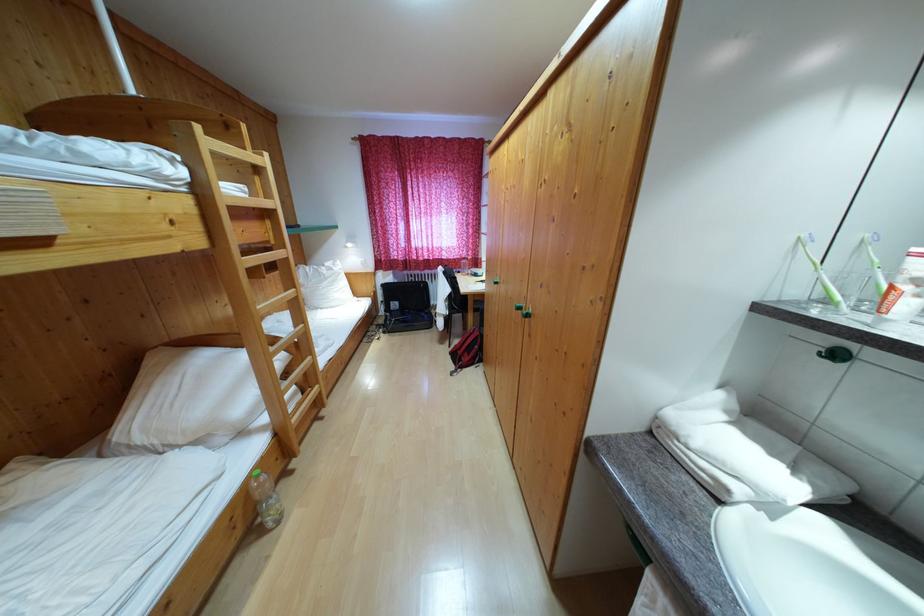
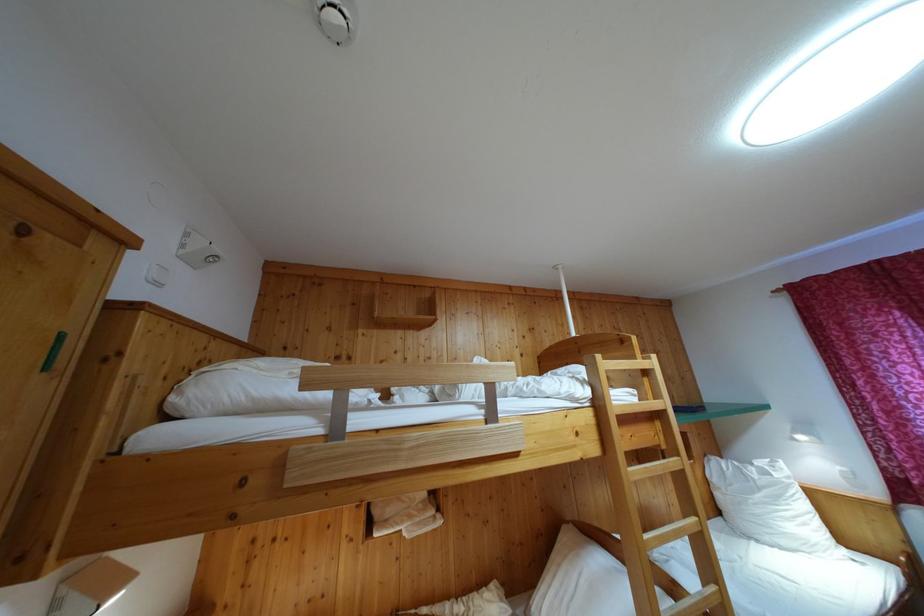
Where in the second image is the point corresponding to the point at 278,217 from the first image?

(669, 418)